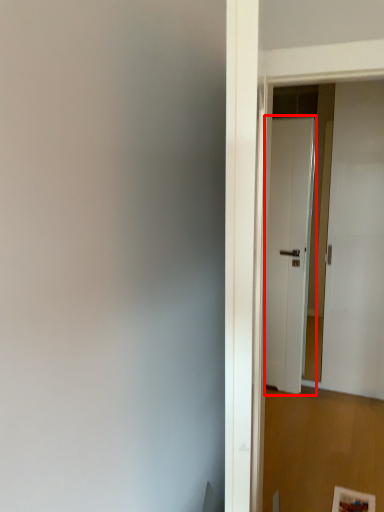
Question: In this image, where is door (annotated by the red box) located relative to door?

Choices:
 (A) right
 (B) left

Answer: (B)